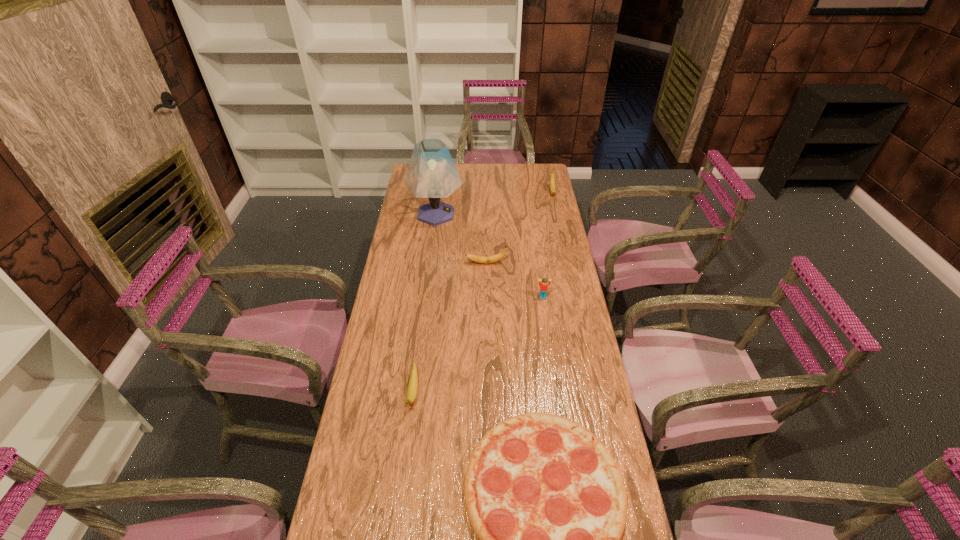
Identify the location of free space between the fourth farthest object and the leftmost banana. (478, 345).

Where is `object that is the fourth closest to the tallest object`? object that is the fourth closest to the tallest object is located at coordinates (413, 382).

Locate an element on the screen. This screenshot has height=540, width=960. the closest object to the nearest object is located at coordinates (413, 382).

Locate which banana ranks second in proximity to the third nearest object. Please provide its 2D coordinates. Your answer should be formatted as a tuple, i.e. [(x, y)], where the tuple contains the x and y coordinates of a point satisfying the conditions above.

[(413, 382)]

Locate which banana is the closest to the farthest object. Please provide its 2D coordinates. Your answer should be formatted as a tuple, i.e. [(x, y)], where the tuple contains the x and y coordinates of a point satisfying the conditions above.

[(494, 258)]

This screenshot has width=960, height=540. What are the coordinates of `vacant space that satisfies the following two spatial constraints: 1. on the peel of the second shortest banana from the top; 2. at the stem of the shortest banana` in the screenshot? It's located at (488, 393).

Where is `vacant area in the image that satisfies the following two spatial constraints: 1. at the start of the peel on the rightmost banana; 2. on the peel of the second banana from right to left from the top`? vacant area in the image that satisfies the following two spatial constraints: 1. at the start of the peel on the rightmost banana; 2. on the peel of the second banana from right to left from the top is located at coordinates (568, 263).